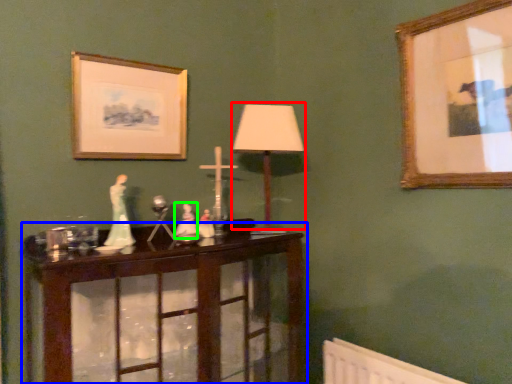
Question: Which object is the farthest from table lamp (highlighted by a red box)? Choose among these: table (highlighted by a blue box) or toy (highlighted by a green box).

Choices:
 (A) table
 (B) toy

Answer: (A)